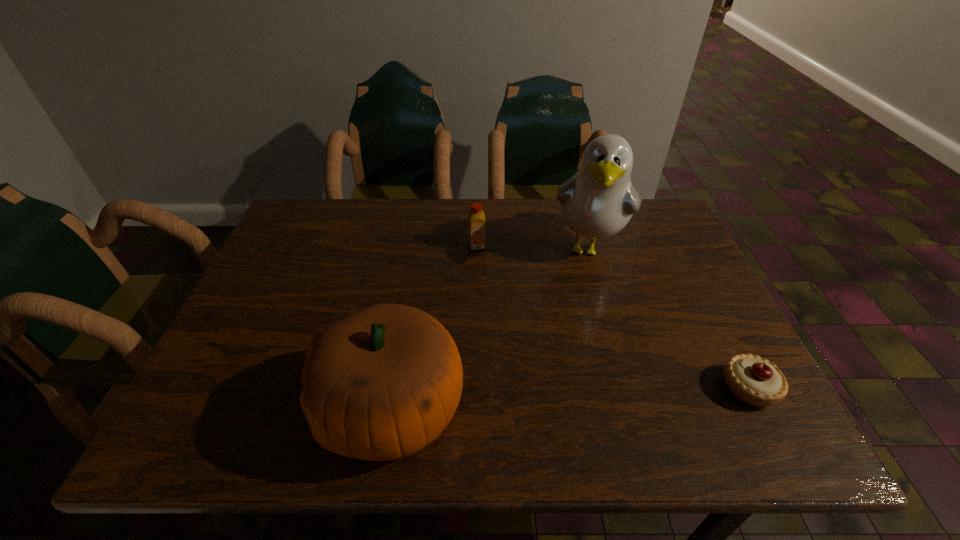
Where is `vacant space on the desktop that is between the pumpkin and the rightmost object and is positioned on the front and back of the orange juice`? vacant space on the desktop that is between the pumpkin and the rightmost object and is positioned on the front and back of the orange juice is located at coordinates (526, 401).

This screenshot has width=960, height=540. Find the location of `free space on the desktop that is between the third shortest object and the rightmost object and is positioned on the beak of the gull`. free space on the desktop that is between the third shortest object and the rightmost object and is positioned on the beak of the gull is located at coordinates (560, 399).